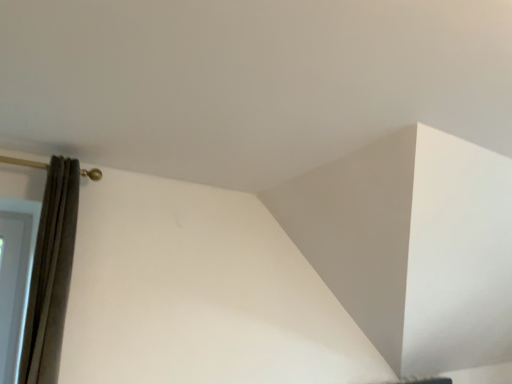
The height and width of the screenshot is (384, 512). I want to click on dark gray fabric curtain at left, so click(51, 274).

The image size is (512, 384). What do you see at coordinates (51, 274) in the screenshot?
I see `dark gray fabric curtain at left` at bounding box center [51, 274].

Where is `dark gray fabric curtain at left`? Image resolution: width=512 pixels, height=384 pixels. dark gray fabric curtain at left is located at coordinates (51, 274).